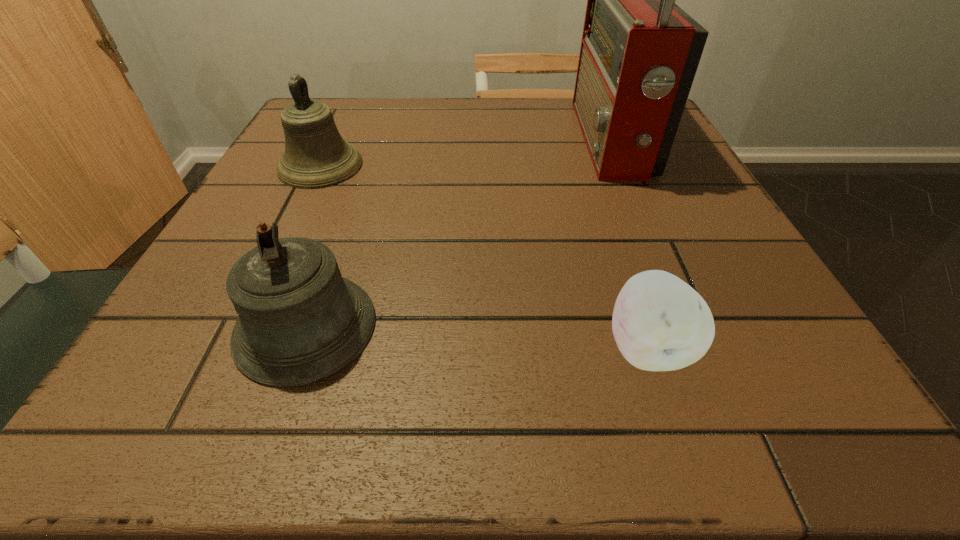
This screenshot has height=540, width=960. In the image, there is a desktop. Find the location of `blank space at the far edge`. blank space at the far edge is located at coordinates (572, 117).

Identify the location of vacant region at the near edge of the desktop. The height and width of the screenshot is (540, 960). (507, 404).

In order to click on free space at the right edge of the desktop in this screenshot , I will do coord(635,191).

Where is `free space at the near right corner of the desktop`? The height and width of the screenshot is (540, 960). free space at the near right corner of the desktop is located at coordinates (864, 427).

Locate an element on the screen. This screenshot has height=540, width=960. free space between the radio receiver and the farther bell is located at coordinates (466, 153).

I want to click on free area in between the shortest object and the radio receiver, so click(x=629, y=244).

Where is `vacant area that lies between the apple and the farther bell`? vacant area that lies between the apple and the farther bell is located at coordinates click(484, 256).

The width and height of the screenshot is (960, 540). Identify the location of vacant area that lies between the radio receiver and the apple. (629, 244).

The image size is (960, 540). Identify the location of free space between the tallest object and the nearer bell. (458, 233).

At what (x,y) coordinates should I click in order to perform the action: click on empty location between the apple and the nearer bell. Please return your answer as a coordinate pair (x, y). The image size is (960, 540). Looking at the image, I should click on (476, 337).